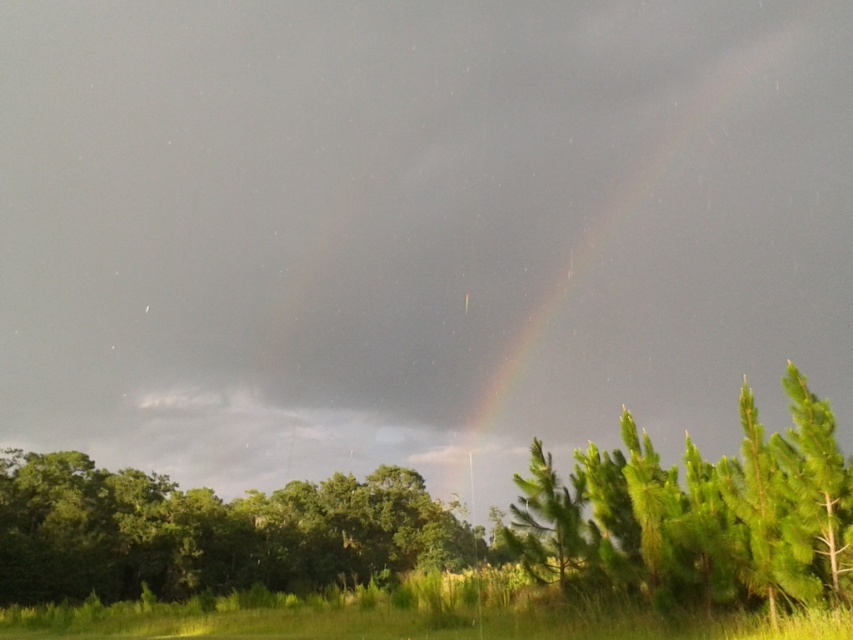
Question: Which of these objects is positioned closest to the green leafy tree at lower center?

Choices:
 (A) green needle-like at center
 (B) rainbow at upper right

Answer: (A)

Question: Is rainbow at upper right smaller than green needle-like at center?

Choices:
 (A) yes
 (B) no

Answer: (B)

Question: Which point is closer to the camera?

Choices:
 (A) green needle-like at center
 (B) green leafy tree at lower center
 (C) rainbow at upper right

Answer: (A)

Question: Does green needle-like at center lie in front of green leafy tree at lower center?

Choices:
 (A) yes
 (B) no

Answer: (A)

Question: Is rainbow at upper right below green leafy tree at lower center?

Choices:
 (A) no
 (B) yes

Answer: (A)

Question: Based on their relative distances, which object is nearer to the green leafy tree at lower center?

Choices:
 (A) rainbow at upper right
 (B) green needle-like at center

Answer: (B)